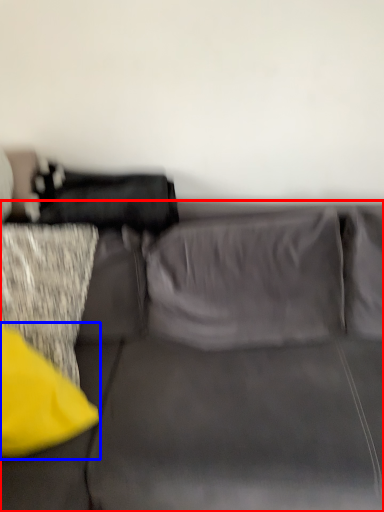
Question: Which point is closer to the camera, studio couch (highlighted by a red box) or pillow (highlighted by a blue box)?

Choices:
 (A) studio couch
 (B) pillow

Answer: (A)